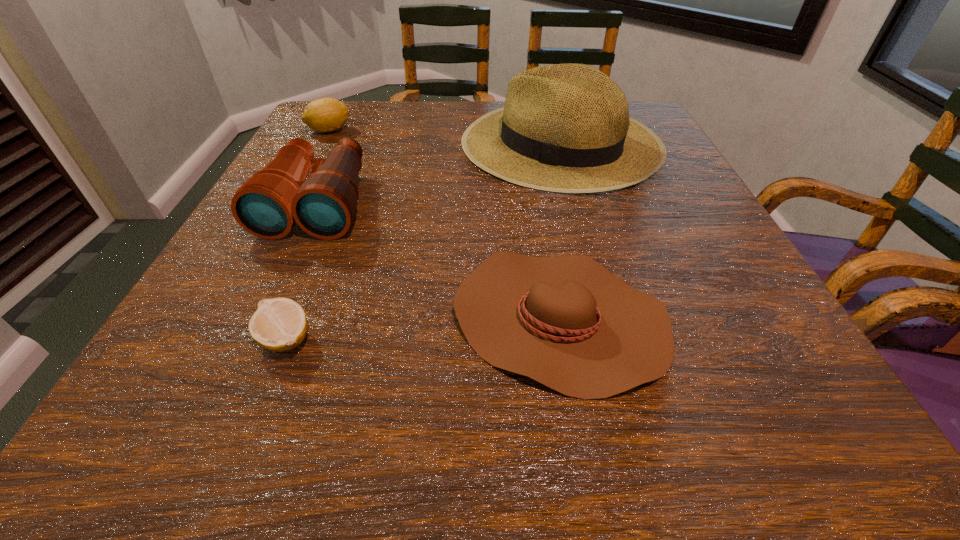
In order to click on vacant space located 0.320m on the left of the cowboy hat in this screenshot , I will do tap(235, 318).

The width and height of the screenshot is (960, 540). What are the coordinates of `free space located on the right of the shorter lemon` in the screenshot? It's located at (477, 339).

Image resolution: width=960 pixels, height=540 pixels. What are the coordinates of `sunhat at the far edge` in the screenshot? It's located at (566, 128).

The height and width of the screenshot is (540, 960). In order to click on lemon located at the far edge in this screenshot , I will do `click(322, 115)`.

Locate an element on the screen. The image size is (960, 540). object positioned at the near edge is located at coordinates (567, 322).

Locate an element on the screen. binoculars present at the left edge is located at coordinates (267, 205).

Image resolution: width=960 pixels, height=540 pixels. I want to click on object that is positioned at the right edge, so click(x=566, y=128).

This screenshot has height=540, width=960. What are the coordinates of `object that is at the far left corner` in the screenshot? It's located at (322, 115).

I want to click on object that is at the far right corner, so click(x=566, y=128).

Locate an element on the screen. This screenshot has height=540, width=960. vacant space at the far edge of the desktop is located at coordinates (388, 114).